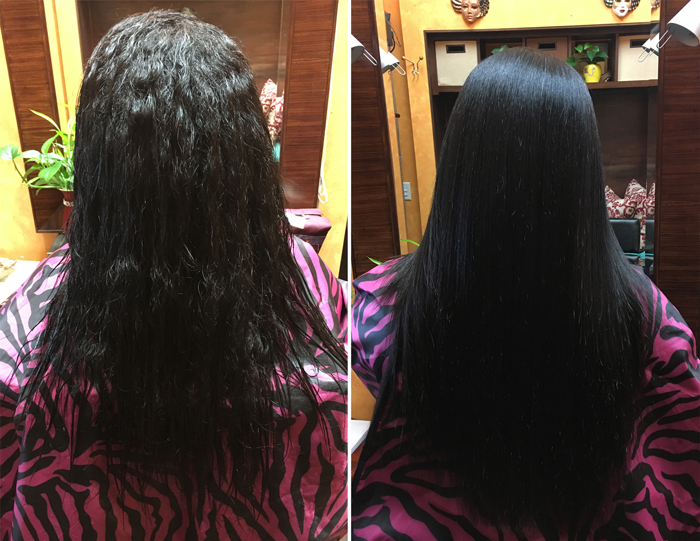
The image size is (700, 541). Find the location of `mirror`. mirror is located at coordinates (260, 29).